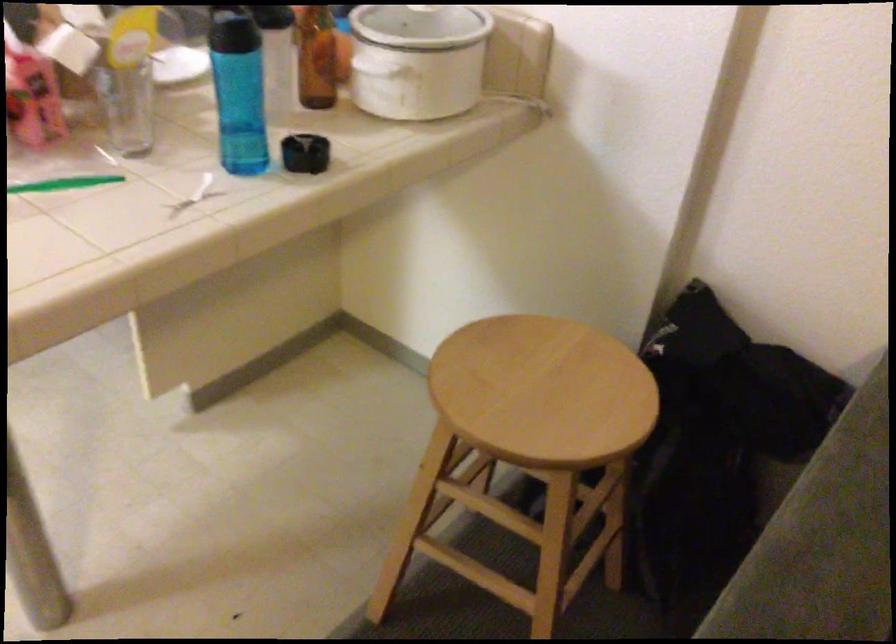
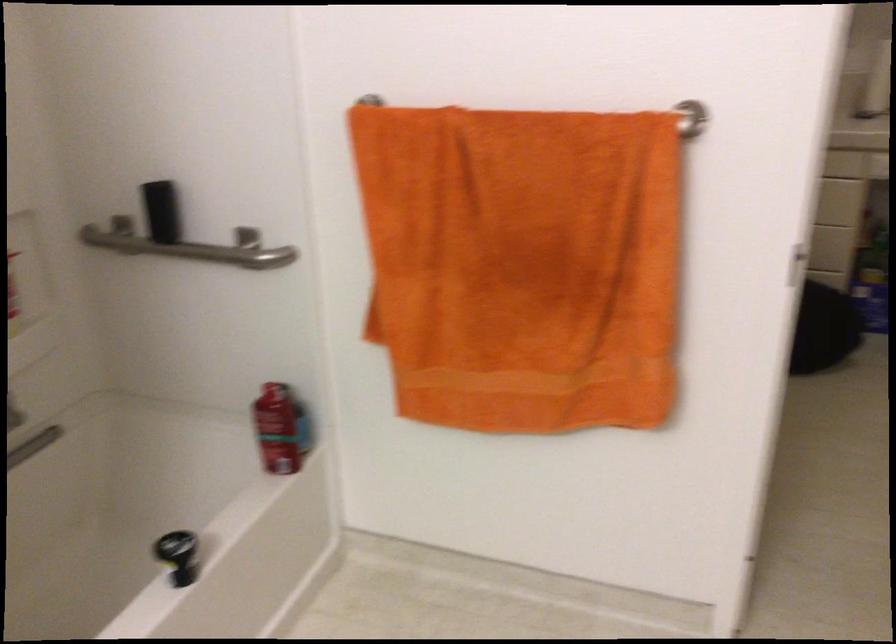
Question: In a continuous first-person perspective shot, in which direction is the camera moving?

Choices:
 (A) Left
 (B) Right
 (C) Forward
 (D) Backward

Answer: (A)